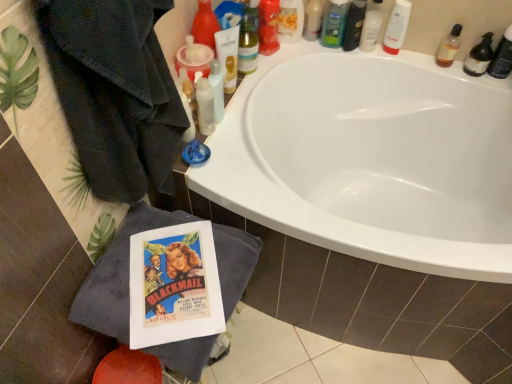
Question: Is translucent plastic bottle at upper right, the 1th toiletry in the right-to-left sequence, looking in the opposite direction of white plastic tube at upper right, acting as the 6th toiletry starting from the left?

Choices:
 (A) yes
 (B) no

Answer: (B)

Question: From the image's perspective, is translucent plastic bottle at upper right, the 1th toiletry in the right-to-left sequence, above white plastic tube at upper right, acting as the 6th toiletry starting from the left?

Choices:
 (A) no
 (B) yes

Answer: (A)

Question: From the image's perspective, is translucent plastic bottle at upper right, which ranks as the 9th toiletry in left-to-right order, beneath white plastic tube at upper right, acting as the 6th toiletry starting from the left?

Choices:
 (A) yes
 (B) no

Answer: (A)

Question: Are translucent plastic bottle at upper right, which ranks as the 9th toiletry in left-to-right order, and white plastic tube at upper right, acting as the 6th toiletry starting from the left, located far from each other?

Choices:
 (A) no
 (B) yes

Answer: (A)

Question: From a real-world perspective, is translucent plastic bottle at upper right, which ranks as the 9th toiletry in left-to-right order, positioned over white plastic tube at upper right, which is the fourth toiletry in right-to-left order, based on gravity?

Choices:
 (A) no
 (B) yes

Answer: (B)

Question: Looking at their shapes, would you say shiny plastic bottle at upper right, which appears as the fifth toiletry when viewed from the right, is wider or thinner than translucent plastic bottle at upper right, arranged as the 8th toiletry when viewed from the left?

Choices:
 (A) wide
 (B) thin

Answer: (A)

Question: Is shiny plastic bottle at upper right, which appears as the fifth toiletry when viewed from the right, bigger or smaller than translucent plastic bottle at upper right, which ranks as the 2th toiletry in right-to-left order?

Choices:
 (A) small
 (B) big

Answer: (B)

Question: In the image, is shiny plastic bottle at upper right, which ranks as the 5th toiletry in left-to-right order, positioned in front of or behind translucent plastic bottle at upper right, which ranks as the 2th toiletry in right-to-left order?

Choices:
 (A) front
 (B) behind

Answer: (B)

Question: From the image's perspective, is shiny plastic bottle at upper right, which appears as the fifth toiletry when viewed from the right, above or below translucent plastic bottle at upper right, arranged as the 8th toiletry when viewed from the left?

Choices:
 (A) above
 (B) below

Answer: (A)

Question: Relative to translucent plastic tube at upper center, the second mouthwash viewed from the right, is white plastic tube at upper right, acting as the 6th toiletry starting from the left, in front or behind?

Choices:
 (A) behind
 (B) front

Answer: (A)

Question: In the image, is white plastic tube at upper right, which is the fourth toiletry in right-to-left order, on the left side or the right side of translucent plastic tube at upper center, which is the first mouthwash from left to right?

Choices:
 (A) left
 (B) right

Answer: (B)

Question: Which is correct: white plastic tube at upper right, which is the fourth toiletry in right-to-left order, is inside translucent plastic tube at upper center, the second mouthwash viewed from the right, or outside of it?

Choices:
 (A) inside
 (B) outside

Answer: (B)

Question: From their relative heights in the image, would you say white plastic tube at upper right, acting as the 6th toiletry starting from the left, is taller or shorter than translucent plastic tube at upper center, the second mouthwash viewed from the right?

Choices:
 (A) short
 (B) tall

Answer: (A)

Question: In terms of height, does translucent plastic bottle at upper right, which ranks as the 2th toiletry in right-to-left order, look taller or shorter compared to translucent plastic bottle at upper center, which is the 1th toiletry in left-to-right order?

Choices:
 (A) tall
 (B) short

Answer: (B)

Question: In the image, is translucent plastic bottle at upper right, arranged as the 8th toiletry when viewed from the left, on the left side or the right side of translucent plastic bottle at upper center, the 9th toiletry positioned from the right?

Choices:
 (A) right
 (B) left

Answer: (A)